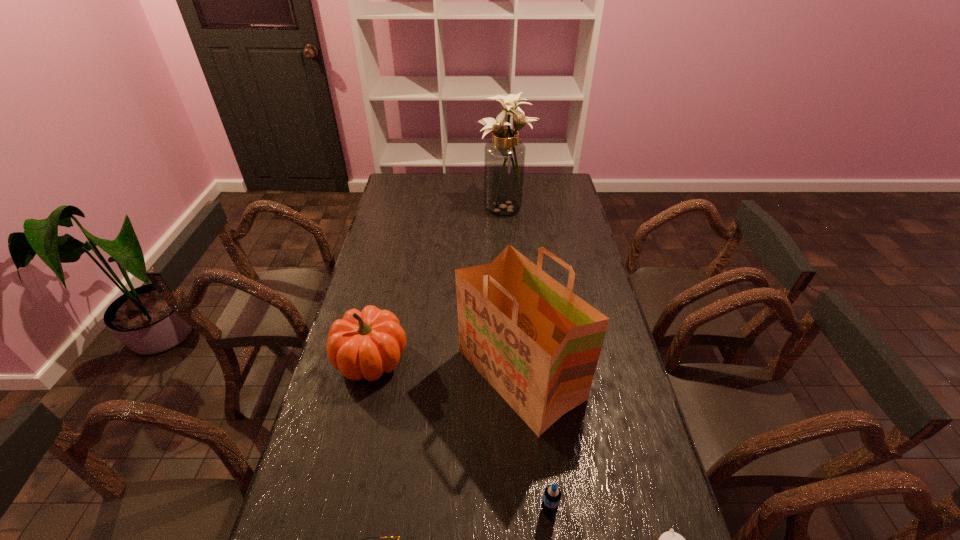
This screenshot has height=540, width=960. What are the coordinates of `object positioned at the left edge` in the screenshot? It's located at (365, 344).

You are a GUI agent. You are given a task and a screenshot of the screen. Output one action in this format:
    pyautogui.click(x=<x>, y=<y>)
    Task: Click on the object present at the right edge
    Image resolution: width=960 pixels, height=540 pixels.
    Given the screenshot: What is the action you would take?
    pyautogui.click(x=537, y=343)

This screenshot has height=540, width=960. In the image, there is a desktop. In order to click on vacant area at the far edge in this screenshot , I will do `click(444, 178)`.

In the image, there is a desktop. Find the location of `vacant space at the left edge`. vacant space at the left edge is located at coordinates (375, 245).

The width and height of the screenshot is (960, 540). In the image, there is a desktop. What are the coordinates of `vacant space at the right edge` in the screenshot? It's located at 567,197.

Find the location of a particular element. The width and height of the screenshot is (960, 540). vacant space in between the pumpkin and the fourth farthest object is located at coordinates (460, 435).

Choose which object is the fourth nearest neighbor to the pumpkin. Please provide its 2D coordinates. Your answer should be formatted as a tuple, i.e. [(x, y)], where the tuple contains the x and y coordinates of a point satisfying the conditions above.

[(504, 156)]

The height and width of the screenshot is (540, 960). Find the location of `object that is the fifth closest one to the flower arrangement`. object that is the fifth closest one to the flower arrangement is located at coordinates (670, 539).

Identify the location of free spot that satisfies the following two spatial constraints: 1. on the front side of the farthest object; 2. on the right side of the grocery bag. (518, 375).

Where is `vacant position in the image that satisfies the following two spatial constraints: 1. on the back side of the third tallest object; 2. on the right side of the flower arrangement`? vacant position in the image that satisfies the following two spatial constraints: 1. on the back side of the third tallest object; 2. on the right side of the flower arrangement is located at coordinates (407, 206).